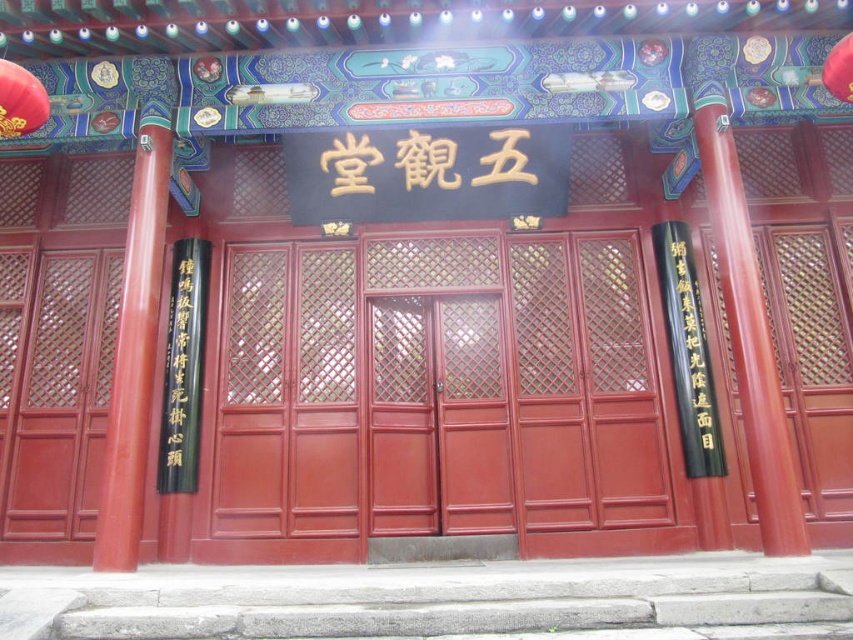
Can you confirm if black paper writing at right is positioned below matte red paper lantern at upper left?

Yes.

Between black paper writing at right and matte red paper lantern at upper left, which one is positioned lower?

Positioned lower is black paper writing at right.

Where is `black paper writing at right`? black paper writing at right is located at coordinates (688, 353).

Between black paper with gold characters at left and matte red paper lantern at upper left, which one is positioned lower?

black paper with gold characters at left is lower down.

Does point (177, 464) come in front of point (30, 108)?

That is False.

At what (x,y) coordinates should I click in order to perform the action: click on black paper with gold characters at left. Please return your answer as a coordinate pair (x, y). Looking at the image, I should click on (183, 371).

Can you confirm if matte wood door at center is positioned to the right of black paper with gold characters at left?

Correct, you'll find matte wood door at center to the right of black paper with gold characters at left.

Can you confirm if matte wood door at center is thinner than black paper with gold characters at left?

In fact, matte wood door at center might be wider than black paper with gold characters at left.

Is point (534, 433) behind point (195, 387)?

No.

Where is `matte wood door at center`? This screenshot has height=640, width=853. matte wood door at center is located at coordinates (440, 397).